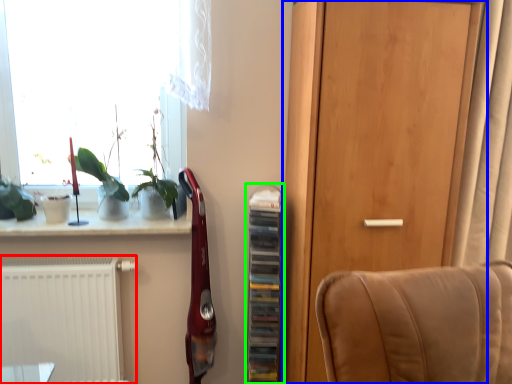
Question: Which object is the closest to the radiator (highlighted by a red box)? Choose among these: door (highlighted by a blue box) or shelf (highlighted by a green box).

Choices:
 (A) door
 (B) shelf

Answer: (B)